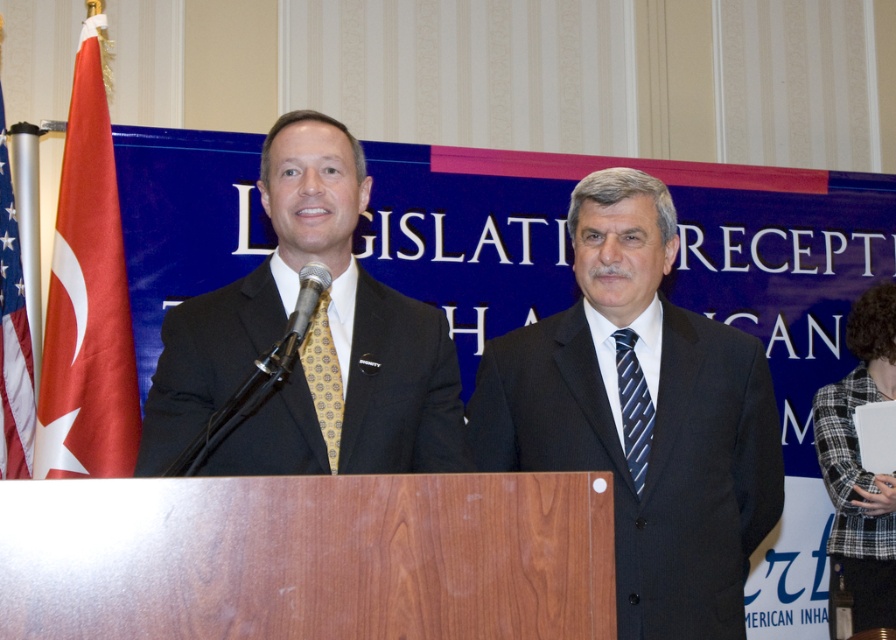
Question: Which point is farther from the camera taking this photo?

Choices:
 (A) pyautogui.click(x=593, y=320)
 (B) pyautogui.click(x=317, y=266)
 (C) pyautogui.click(x=625, y=355)
 (D) pyautogui.click(x=4, y=371)

Answer: (D)

Question: Which of the following is the farthest from the observer?

Choices:
 (A) (874, 620)
 (B) (330, 280)
 (C) (278, 449)
 (D) (631, 449)

Answer: (A)

Question: Is matte black suit at center thinner than plaid wool jacket at lower right?

Choices:
 (A) yes
 (B) no

Answer: (B)

Question: Which object is the farthest from the yellowpatterned fabrictie at left?

Choices:
 (A) dark gray suit at center
 (B) metallic gold tie at center
 (C) plaid wool jacket at lower right

Answer: (C)

Question: In this image, where is plaid wool jacket at lower right located relative to blue striped tie at right?

Choices:
 (A) above
 (B) below

Answer: (B)

Question: Is matte black suit at center bigger than american flag at left?

Choices:
 (A) yes
 (B) no

Answer: (A)